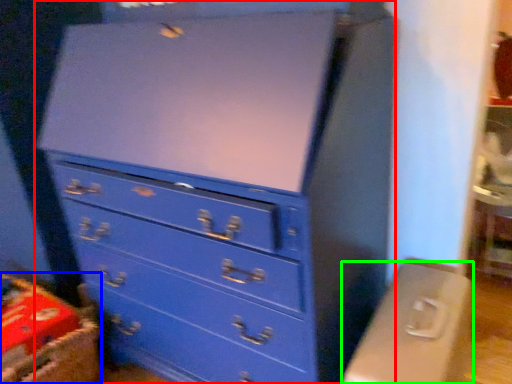
Question: Estimate the real-world distances between objects in this image. Which object is farther from chest of drawers (highlighted by a red box), crate (highlighted by a blue box) or computer desk (highlighted by a green box)?

Choices:
 (A) crate
 (B) computer desk

Answer: (A)